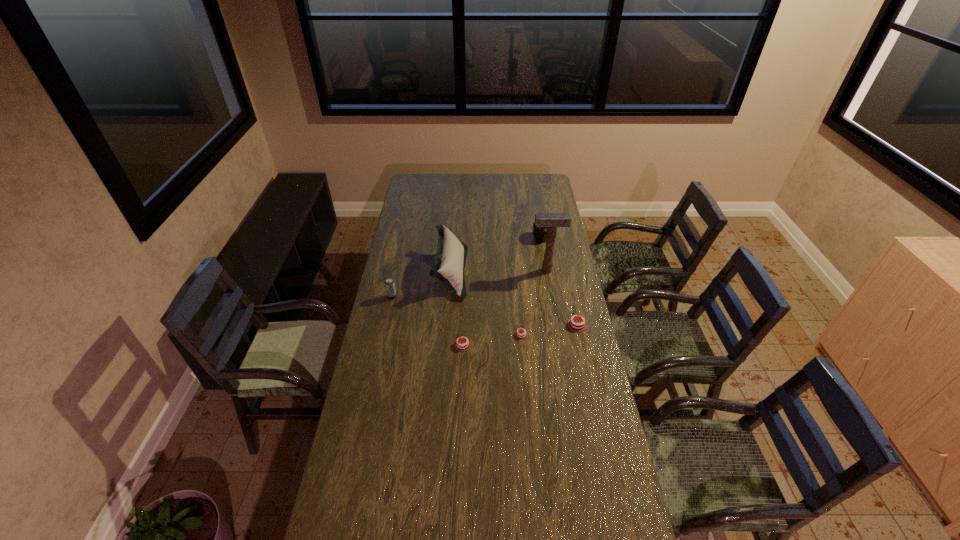
At what (x,y) coordinates should I click in order to perform the action: click on vacant space located 0.190m on the left of the second shortest chocolate cake. Please return your answer as a coordinate pair (x, y). This screenshot has width=960, height=540. Looking at the image, I should click on (395, 345).

Where is `free spot located 0.300m on the left of the fourth object from left to right`? free spot located 0.300m on the left of the fourth object from left to right is located at coordinates (432, 335).

Where is `vacant point located on the front of the rightmost chocolate cake`? vacant point located on the front of the rightmost chocolate cake is located at coordinates (595, 409).

The height and width of the screenshot is (540, 960). I want to click on free space located on the front-facing side of the telephoto lens, so click(x=498, y=238).

Locate an element on the screen. Image resolution: width=960 pixels, height=540 pixels. blank space located on the front-facing side of the telephoto lens is located at coordinates (500, 238).

The width and height of the screenshot is (960, 540). In order to click on vacant region located 0.180m on the front-facing side of the telephoto lens in this screenshot , I will do `click(498, 238)`.

This screenshot has height=540, width=960. Identify the location of free space located 0.070m on the surface of the sixth shortest object. (482, 272).

Where is `free location located 0.340m on the front of the mallet`? free location located 0.340m on the front of the mallet is located at coordinates (556, 327).

What are the coordinates of `vacant space located on the right of the leftmost object` in the screenshot? It's located at (417, 297).

Identify the location of object positioned at the left edge. This screenshot has height=540, width=960. (389, 283).